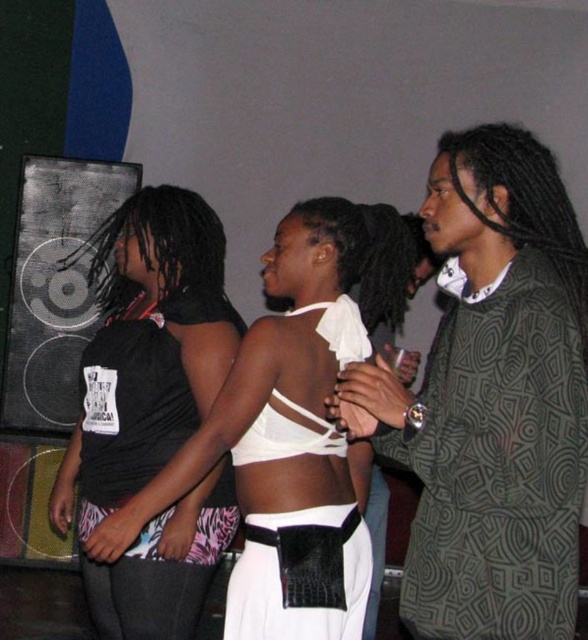
Question: Which point appears closest to the camera in this image?

Choices:
 (A) (459, 291)
 (B) (300, 346)

Answer: (A)

Question: Can you confirm if patterned fabric shirt at right is smaller than white matte tank top at center?

Choices:
 (A) yes
 (B) no

Answer: (A)

Question: Can you confirm if patterned fabric shirt at right is positioned to the right of black matte tank top at left?

Choices:
 (A) yes
 (B) no

Answer: (A)

Question: Which point is farther from the camera taking this photo?

Choices:
 (A) (153, 193)
 (B) (543, 621)
 (C) (235, 448)

Answer: (A)

Question: Can you confirm if black matte tank top at left is positioned above white matte tank top at center?

Choices:
 (A) no
 (B) yes

Answer: (A)

Question: Among these points, which one is nearest to the camera?

Choices:
 (A) (159, 620)
 (B) (532, 163)

Answer: (B)